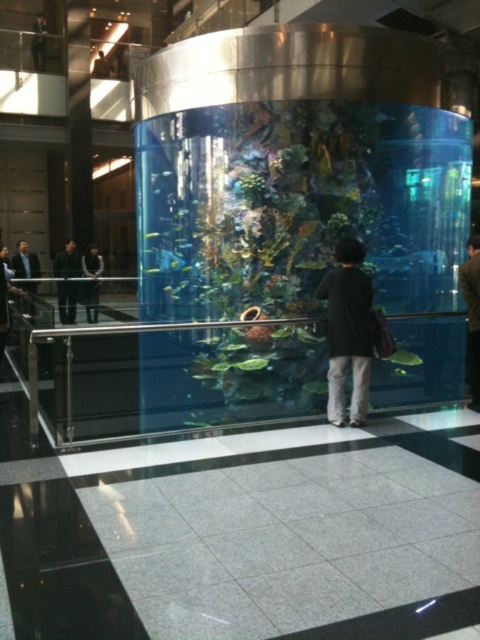
You are a security guard in the mall and need to determine if the black matte jacket at center and dark gray suit at left can both be seen by a camera placed at the back of the aquarium. The camera has a field of view that can capture objects up to 2 meters tall. Can both be seen?

The black matte jacket at center is taller than the dark gray suit at left. Since the camera can capture up to 2 meters, both objects can be seen as their heights are within the camera range.

You are an interior designer evaluating the placement of the black matte jacket at center and the matte black jacket at upper left in the aquarium area. Based on their heights, which one would be more noticeable from the viewing platform?

The black matte jacket at center is taller than the matte black jacket at upper left, so it would be more noticeable from the viewing platform.